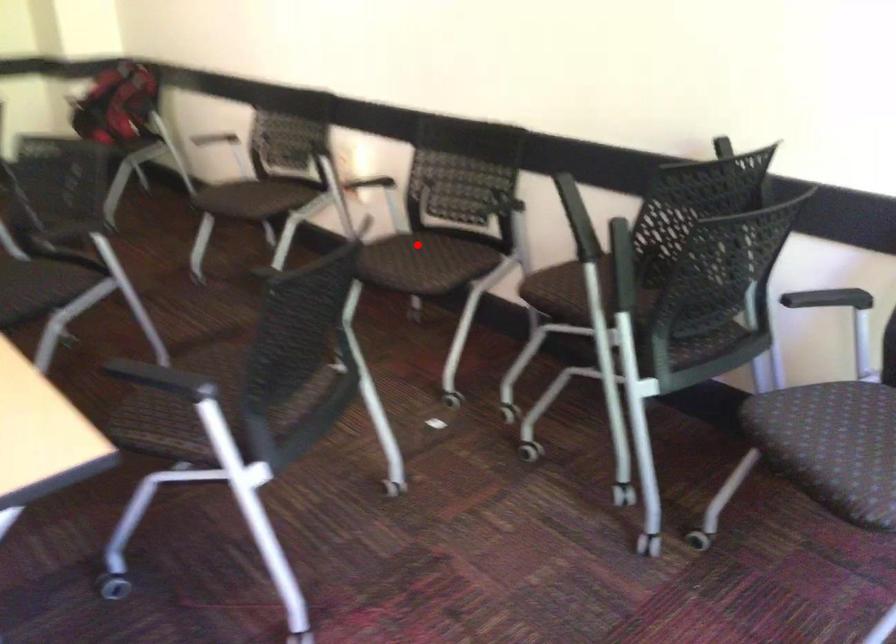
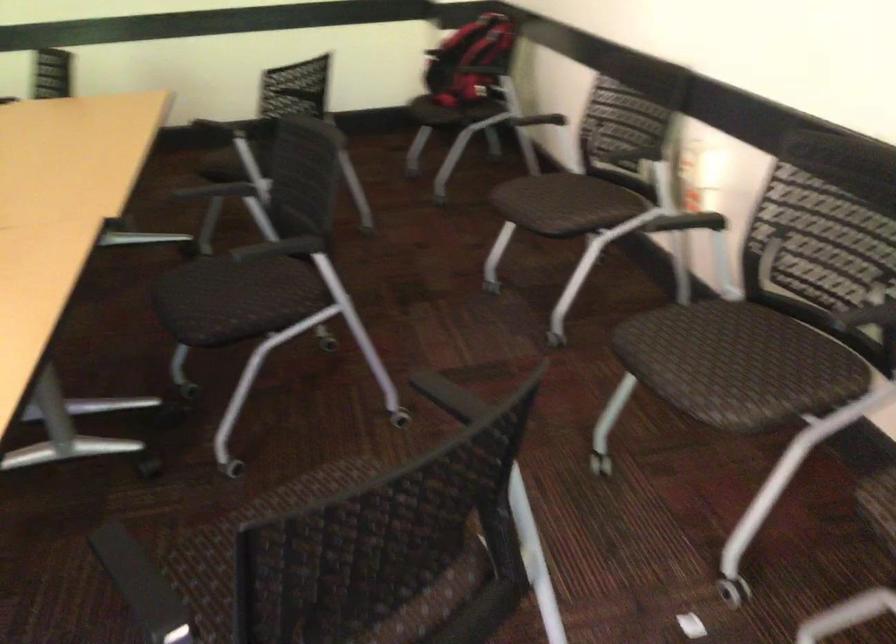
Question: I am providing you with two images of the same scene from different viewpoints. A red point is shown in image1. For the corresponding object point in image2, is it positioned nearer or farther from the camera?

Choices:
 (A) Nearer
 (B) Farther

Answer: (A)